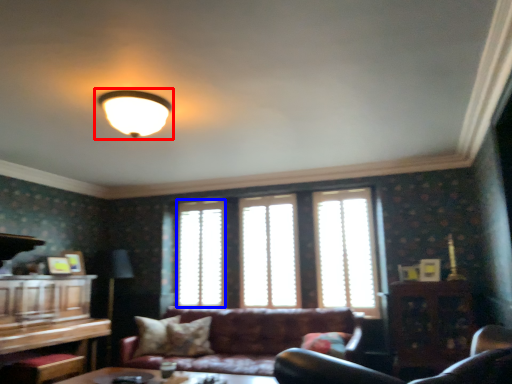
Question: Which point is further to the camera, lamp (highlighted by a red box) or window (highlighted by a blue box)?

Choices:
 (A) lamp
 (B) window

Answer: (B)